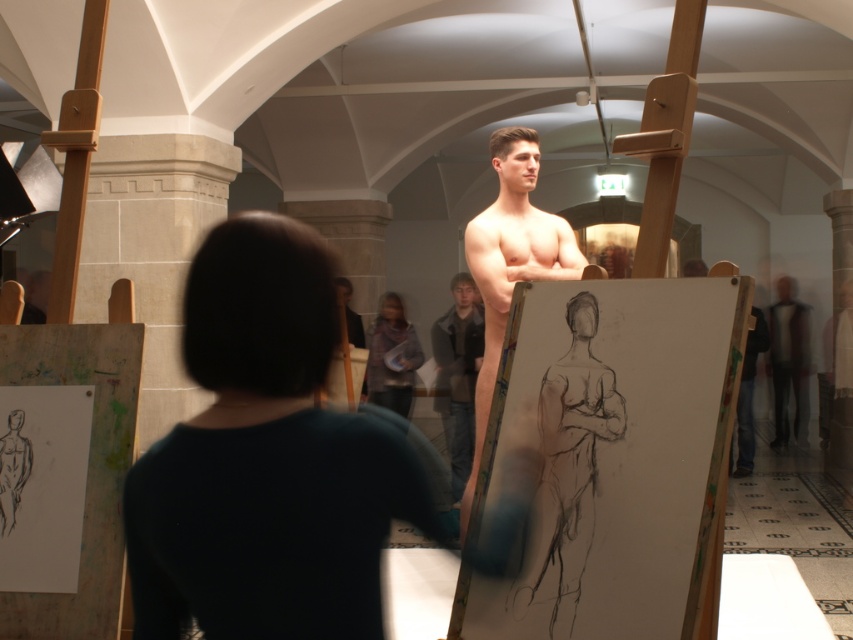
Who is taller, dark brown leather jacket at center or smooth black mannequin at center?

With more height is smooth black mannequin at center.

Is dark brown leather jacket at center in front of smooth black mannequin at center?

Yes, it is.

Where is `dark brown leather jacket at center`? This screenshot has height=640, width=853. dark brown leather jacket at center is located at coordinates (457, 374).

Who is positioned more to the left, smooth skin man at center or smooth skin mannequin at center?

Result: From the viewer's perspective, smooth skin man at center appears more on the left side.

Between smooth skin man at center and smooth skin mannequin at center, which one is positioned lower?

smooth skin man at center

Between point (222, 356) and point (561, 259), which one is positioned behind?

Positioned behind is point (561, 259).

The height and width of the screenshot is (640, 853). Identify the location of smooth skin man at center. (265, 460).

Is smooth skin man at center below dark brown leather jacket at center?

No, smooth skin man at center is not below dark brown leather jacket at center.

Can you confirm if smooth skin man at center is positioned above dark brown leather jacket at center?

Indeed, smooth skin man at center is positioned over dark brown leather jacket at center.

What do you see at coordinates (265, 460) in the screenshot?
I see `smooth skin man at center` at bounding box center [265, 460].

This screenshot has height=640, width=853. I want to click on smooth skin man at center, so click(265, 460).